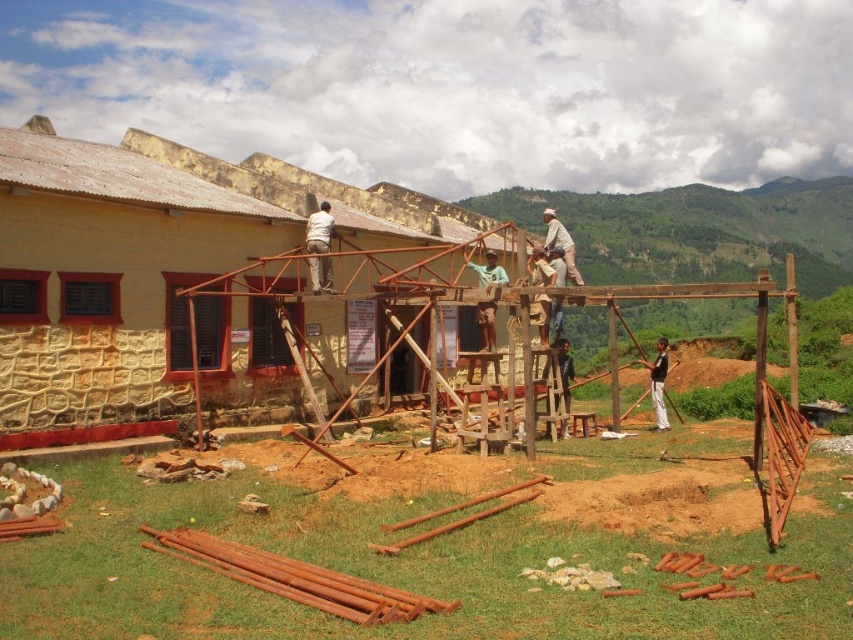
You are a safety inspector at the construction site. You notice a blue fabric shirt at center and a brown wooden ladder at center. Which object has a greater width?

The blue fabric shirt at center has a greater width than the brown wooden ladder at center.

You are standing at the construction site and want to reach the point at coordinates point (235, 369). If your ladder can extend up to 75 feet, will it be long enough to reach that point?

The point (235, 369) is 77.34 feet from the viewer, which is beyond the ladder extension limit of 75 feet. Therefore, the ladder is not long enough to reach the point.